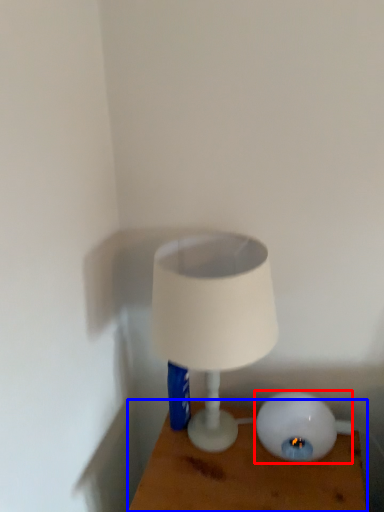
Question: Which object appears closest to the camera in this image, lamp (highlighted by a red box) or furniture (highlighted by a blue box)?

Choices:
 (A) lamp
 (B) furniture

Answer: (B)